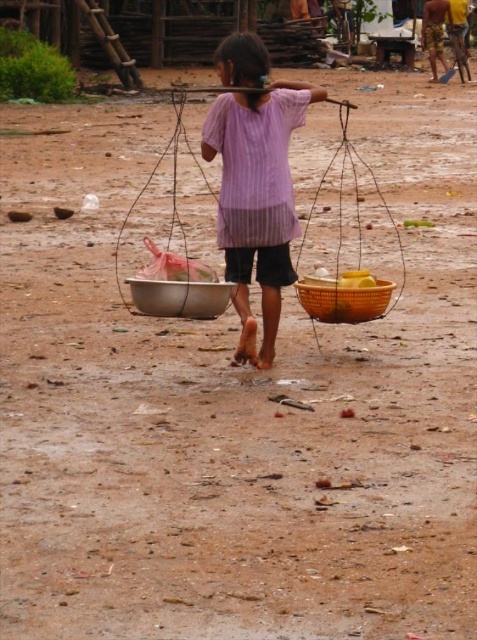
Question: Which of the following is the farthest from the observer?

Choices:
 (A) (253, 38)
 (B) (358, 298)

Answer: (B)

Question: Observing the image, what is the correct spatial positioning of bright yellow woven basket at center in reference to brown hair at center?

Choices:
 (A) left
 (B) right

Answer: (B)

Question: Is purple striped shirt at center closer to camera compared to bright yellow woven basket at center?

Choices:
 (A) yes
 (B) no

Answer: (A)

Question: Which is farther from the bright yellow woven basket at center?

Choices:
 (A) metallic silver bowl at center
 (B) purple striped shirt at center

Answer: (A)

Question: Which object appears closest to the camera in this image?

Choices:
 (A) bright yellow woven basket at center
 (B) metallic silver bowl at center

Answer: (B)

Question: Does bright yellow woven basket at center appear under metallic silver bowl at center?

Choices:
 (A) yes
 (B) no

Answer: (A)